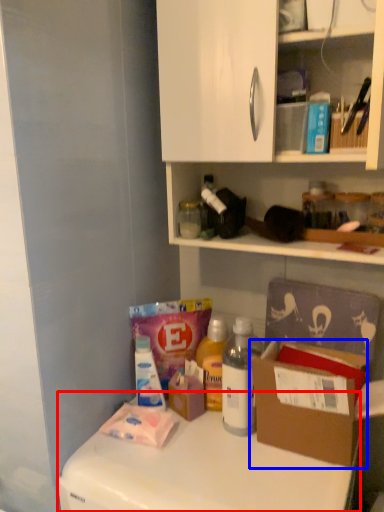
Question: Which object is further to the camera taking this photo, counter top (highlighted by a red box) or cardboard box (highlighted by a blue box)?

Choices:
 (A) counter top
 (B) cardboard box

Answer: (B)